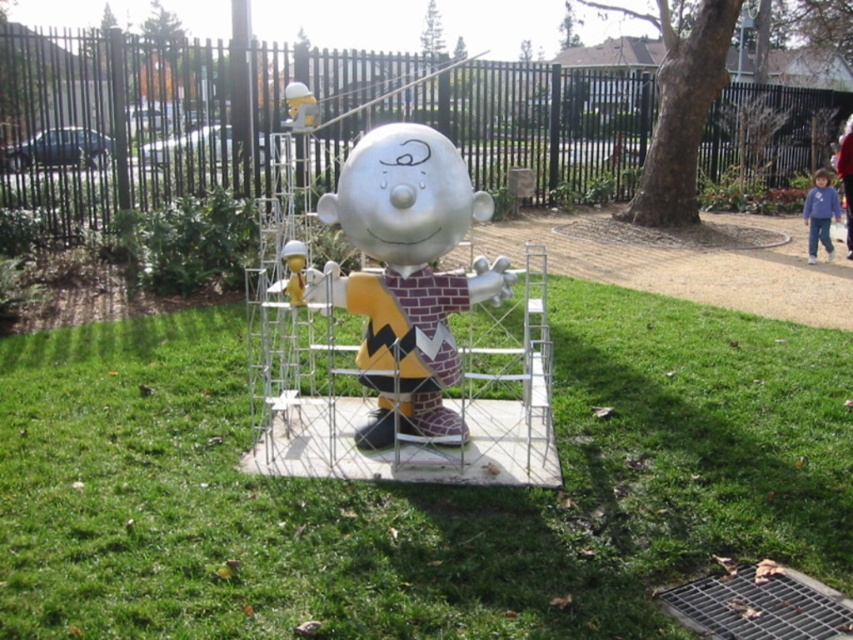
You are a gardener who needs to mow the green grass at center and trim the metallic silver statue at center. Which object requires more attention to height?

The metallic silver statue at center is taller than the green grass at center, so the gardener should focus on trimming the metallic silver statue at center first.

You are standing at point (372, 320) and want to walk to point (660, 440). Given the sculpture is between you and your destination, can you reach the destination without moving around the sculpture?

Point (660, 440) is behind point (372, 320), so you cannot reach it without moving around the sculpture.

You are planning to set up a picnic blanket in the park where the green grass at center and the metallic silver statue at center are located. Since the statue is part of the sculpture, you can place the blanket only on the grass. Considering the size of the grass area, can you fit a standard picnic blanket that requires 2 meters by 2 meters of space?

The green grass at center is bigger than the metallic silver statue at center, so yes, the standard picnic blanket requiring 2 meters by 2 meters of space can fit on the green grass at center since it is larger than the statue.